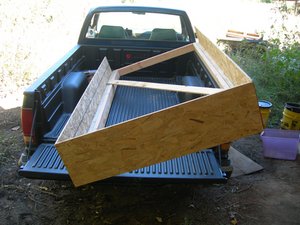
Identify the location of latch. The image size is (300, 225). (175, 171).